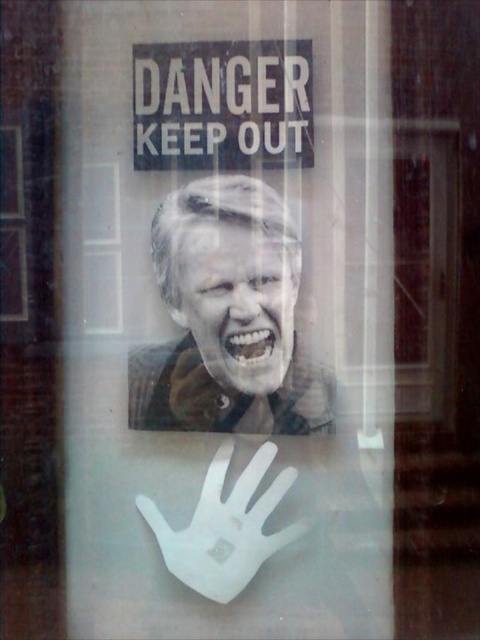
Which of these two, black plastic sign at upper center or smooth skin face at center, stands shorter?

With less height is black plastic sign at upper center.

Is black plastic sign at upper center shorter than smooth skin face at center?

Indeed, black plastic sign at upper center has a lesser height compared to smooth skin face at center.

Describe the element at coordinates (223, 104) in the screenshot. This screenshot has height=640, width=480. I see `black plastic sign at upper center` at that location.

The height and width of the screenshot is (640, 480). What are the coordinates of `black plastic sign at upper center` in the screenshot? It's located at (223, 104).

Between smooth brown leather jacket at center and white matte hand at lower center, which one has less height?

With less height is white matte hand at lower center.

Does point (250, 349) lie behind point (243, 557)?

That is True.

Identify the location of smooth brown leather jacket at center. The width and height of the screenshot is (480, 640). click(x=228, y=317).

Is point (201, 154) closer to camera compared to point (194, 531)?

Yes, it is.

Can you confirm if black plastic sign at upper center is thinner than white matte hand at lower center?

No.

The width and height of the screenshot is (480, 640). What are the coordinates of `black plastic sign at upper center` in the screenshot? It's located at (223, 104).

Locate an element on the screen. The height and width of the screenshot is (640, 480). black plastic sign at upper center is located at coordinates (223, 104).